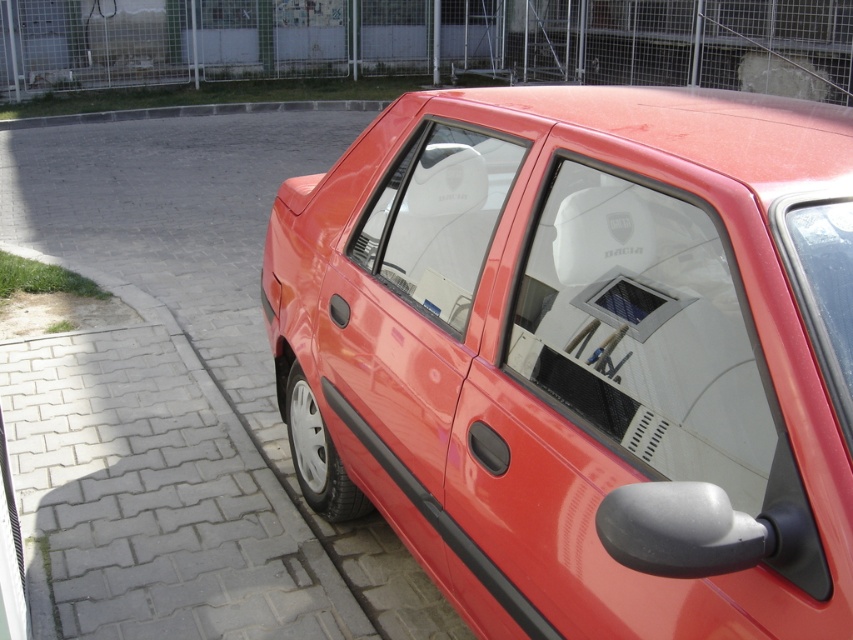
Question: Does glossy plastic car door at center have a smaller size compared to transparent glass windshield at upper right?

Choices:
 (A) yes
 (B) no

Answer: (B)

Question: Does glossy red sedan at center have a smaller size compared to transparent glass windshield at center?

Choices:
 (A) yes
 (B) no

Answer: (B)

Question: Based on their relative distances, which object is nearer to the transparent plastic window at center?

Choices:
 (A) glossy plastic car door at center
 (B) transparent glass windshield at upper right

Answer: (A)

Question: Which of these objects is positioned closest to the glossy red sedan at center?

Choices:
 (A) transparent plastic window at center
 (B) transparent glass windshield at center

Answer: (A)

Question: Which object is the closest to the transparent plastic window at center?

Choices:
 (A) glossy plastic car door at center
 (B) transparent glass windshield at center
 (C) glossy red sedan at center
 (D) transparent glass windshield at upper right

Answer: (A)

Question: Is the position of transparent glass windshield at center more distant than that of glossy plastic car door at center?

Choices:
 (A) no
 (B) yes

Answer: (A)